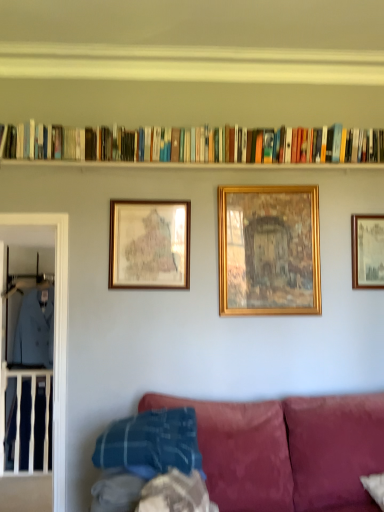
Question: Should I look upward or downward to see gold/gilded picture frame at center, which is the 2th picture frame from left to right?

Choices:
 (A) up
 (B) down

Answer: (A)

Question: Is hardcover books at upper center positioned beyond the bounds of gold-framed picture at upper center, placed as the 1th picture frame when sorted from right to left?

Choices:
 (A) yes
 (B) no

Answer: (A)

Question: Does hardcover books at upper center have a larger size compared to gold-framed picture at upper center, the third picture frame positioned from the left?

Choices:
 (A) no
 (B) yes

Answer: (B)

Question: From a real-world perspective, does hardcover books at upper center sit lower than gold-framed picture at upper center, the third picture frame positioned from the left?

Choices:
 (A) yes
 (B) no

Answer: (B)

Question: Can you confirm if hardcover books at upper center is wider than gold-framed picture at upper center, the third picture frame positioned from the left?

Choices:
 (A) no
 (B) yes

Answer: (B)

Question: From the image's perspective, does hardcover books at upper center appear lower than gold-framed picture at upper center, placed as the 1th picture frame when sorted from right to left?

Choices:
 (A) no
 (B) yes

Answer: (A)

Question: Is hardcover books at upper center positioned far away from gold-framed picture at upper center, the third picture frame positioned from the left?

Choices:
 (A) yes
 (B) no

Answer: (B)

Question: Can you confirm if clear glass door at left is thinner than gold-framed map at center-left, positioned as the first picture frame in left-to-right order?

Choices:
 (A) no
 (B) yes

Answer: (A)

Question: Does clear glass door at left have a greater width compared to gold-framed map at center-left, arranged as the third picture frame when viewed from the right?

Choices:
 (A) no
 (B) yes

Answer: (B)

Question: Can you confirm if clear glass door at left is smaller than gold-framed map at center-left, positioned as the first picture frame in left-to-right order?

Choices:
 (A) yes
 (B) no

Answer: (B)

Question: From a real-world perspective, is clear glass door at left below gold-framed map at center-left, positioned as the first picture frame in left-to-right order?

Choices:
 (A) no
 (B) yes

Answer: (B)

Question: Does clear glass door at left have a greater height compared to gold-framed map at center-left, positioned as the first picture frame in left-to-right order?

Choices:
 (A) yes
 (B) no

Answer: (A)

Question: From the image's perspective, is clear glass door at left on top of gold-framed map at center-left, arranged as the third picture frame when viewed from the right?

Choices:
 (A) yes
 (B) no

Answer: (B)

Question: Can you confirm if hardcover books at upper center is taller than clear glass door at left?

Choices:
 (A) yes
 (B) no

Answer: (B)